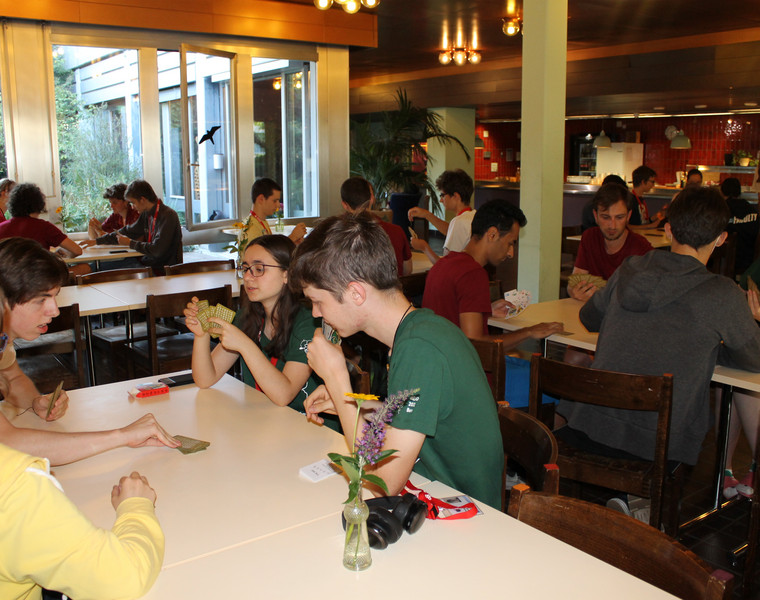
The width and height of the screenshot is (760, 600). Find the location of `overhead lights`. overhead lights is located at coordinates (349, 4), (325, 2), (375, 3), (445, 56), (458, 57), (480, 61), (508, 31), (276, 80), (299, 82).